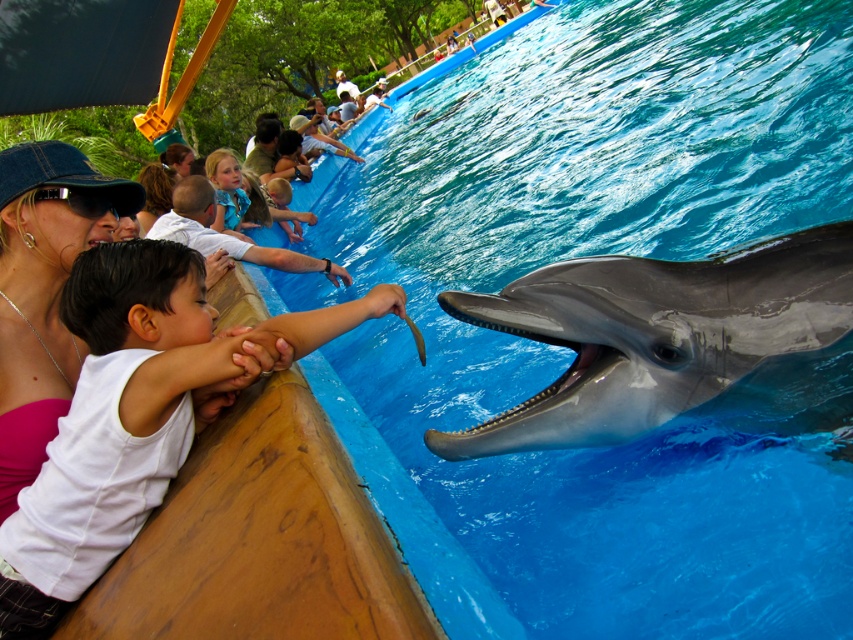
Is point (827, 324) behind point (213, 227)?

No, (827, 324) is closer to viewer.

Who is more distant from viewer, (723, 372) or (253, 180)?

The point (253, 180) is more distant.

Is point (816, 348) positioned in front of point (222, 160)?

That is True.

You are a GUI agent. You are given a task and a screenshot of the screen. Output one action in this format:
    pyautogui.click(x=<x>, y=<y>)
    Task: Click on the smooth gray dolphin at center
    
    Given the screenshot: What is the action you would take?
    pyautogui.click(x=654, y=333)

Is point (123, 282) farther from viewer compared to point (33, 292)?

No, (123, 282) is closer to viewer.

Can you confirm if white matte shirt at left is positioned above pink fabric at upper left?

No.

Is point (44, 500) closer to camera compared to point (80, 166)?

Yes, it is in front of point (80, 166).

What are the coordinates of `white matte shirt at left` in the screenshot? It's located at (131, 413).

Is point (809, 490) farther from camera compared to point (770, 308)?

Yes, it is behind point (770, 308).

Which is above, blue smooth water at upper center or smooth gray dolphin at center?

blue smooth water at upper center is higher up.

Measure the distance between blue smooth water at upper center and camera.

1.26 meters

Locate an element on the screen. blue smooth water at upper center is located at coordinates (596, 253).